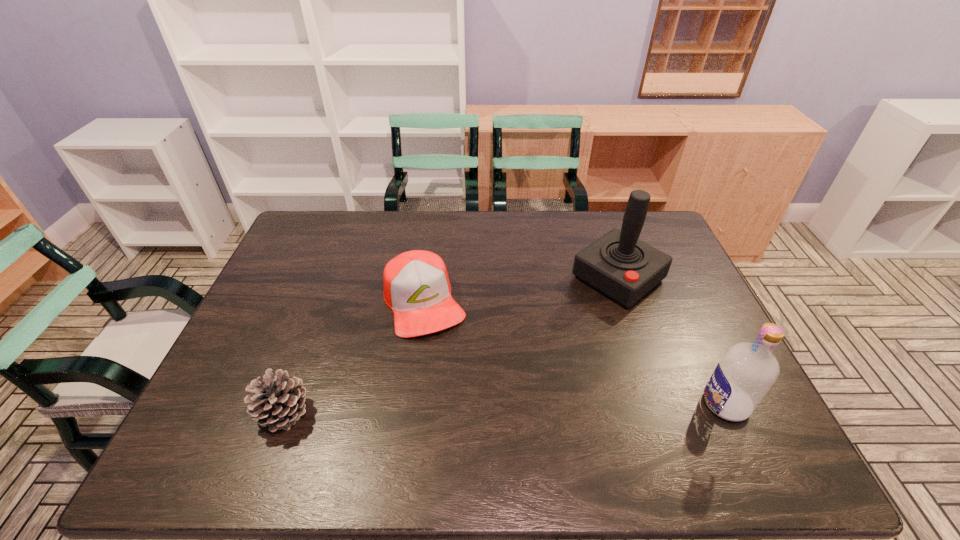
Locate an element on the screen. The width and height of the screenshot is (960, 540). object located at the near left corner is located at coordinates (279, 401).

Locate an element on the screen. This screenshot has width=960, height=540. object present at the far right corner is located at coordinates (619, 265).

At what (x,y) coordinates should I click in order to perform the action: click on object positioned at the near right corner. Please return your answer as a coordinate pair (x, y). Looking at the image, I should click on (747, 371).

The height and width of the screenshot is (540, 960). In order to click on free space at the far edge of the desktop in this screenshot , I will do `click(421, 235)`.

In the image, there is a desktop. Where is `blank space at the near edge`? blank space at the near edge is located at coordinates (639, 426).

The image size is (960, 540). I want to click on blank space at the left edge of the desktop, so click(x=292, y=331).

Identify the location of vacant space at the right edge of the desktop. (706, 373).

The width and height of the screenshot is (960, 540). In order to click on free space between the vodka and the leftmost object in this screenshot , I will do `click(505, 408)`.

Where is `vacant area that lies between the joystick and the leftmost object`? vacant area that lies between the joystick and the leftmost object is located at coordinates (451, 345).

The width and height of the screenshot is (960, 540). In order to click on blank region between the joystick and the leftmost object in this screenshot , I will do `click(451, 345)`.